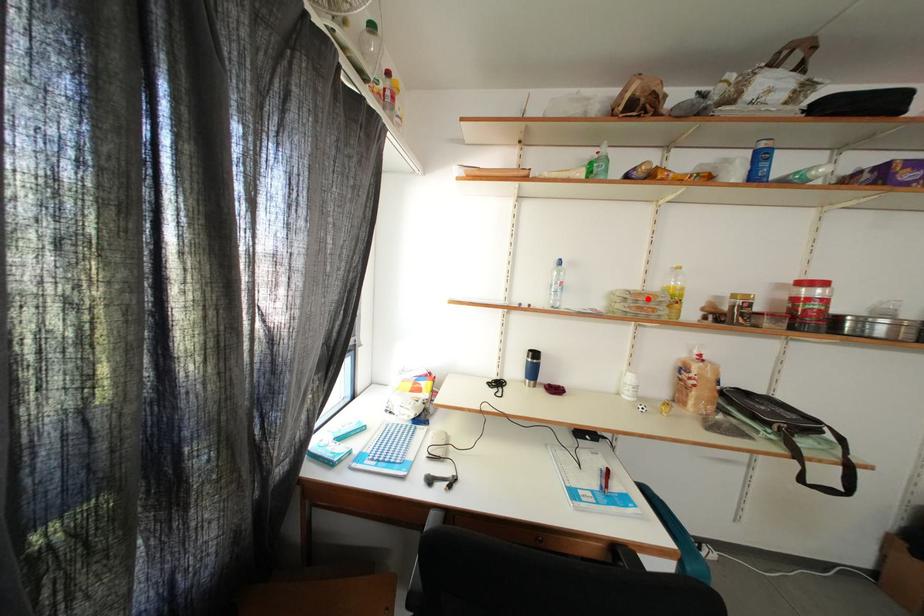
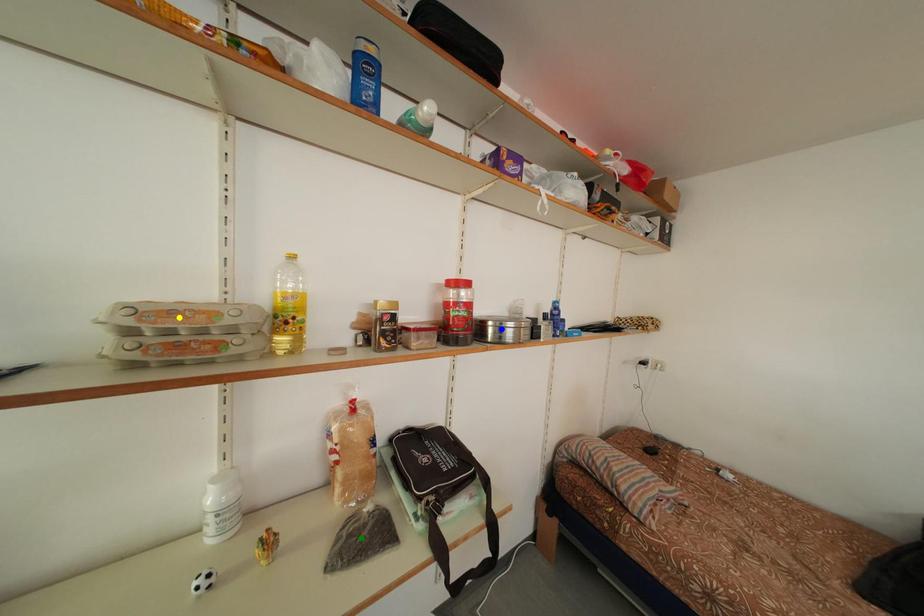
Question: I am providing you with two images of the same scene from different viewpoints. A red point is marked on the first image. You are given multiple points on the second image. Which point in image 2 is actually the same real-world point as the red point in image 1?

Choices:
 (A) yellow point
 (B) green point
 (C) blue point

Answer: (A)